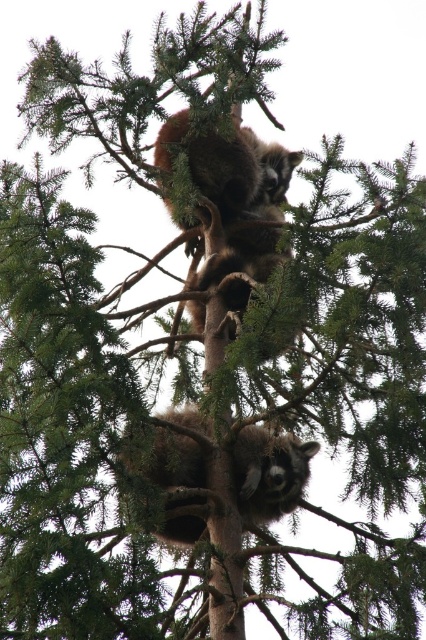
You are a wildlife photographer aiming to capture both raccoons in a single frame. Since your camera has a limited field of view, you need to adjust your position to ensure both the fuzzy brown raccoon at upper center and the fuzzy brown raccoon at center are visible. Based on their positions, which direction should you move your camera to include both raccoons?

The fuzzy brown raccoon at upper center is to the right of the fuzzy brown raccoon at center. To include both in the frame, you should move your camera slightly to the left to capture the raccoon on the right and ensure the lower one remains in view.